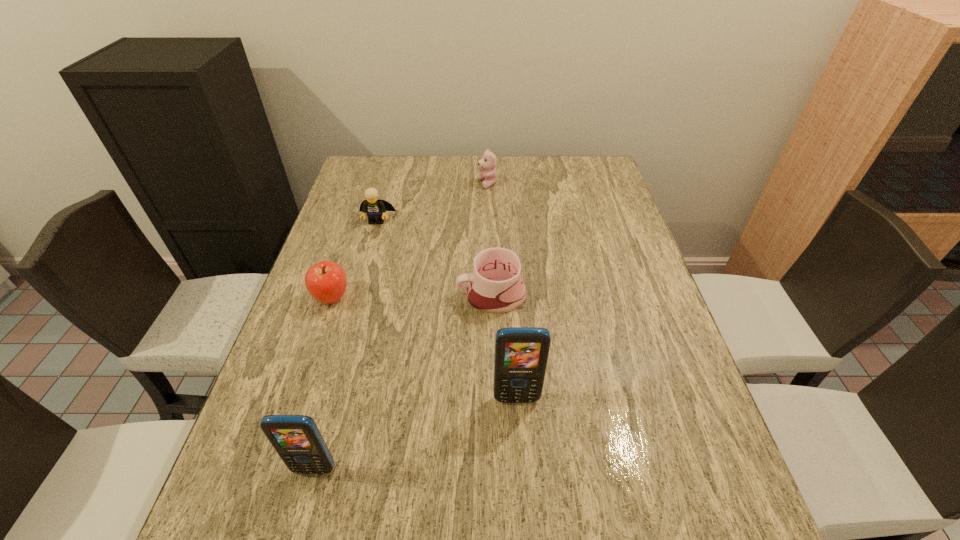
Given the evenly spaced cellular telephones in the image, where should an extra cellular telephone be added on the right to preserve the spacing? Please point to a vacant space. Please provide its 2D coordinates. Your answer should be formatted as a tuple, i.e. [(x, y)], where the tuple contains the x and y coordinates of a point satisfying the conditions above.

[(678, 343)]